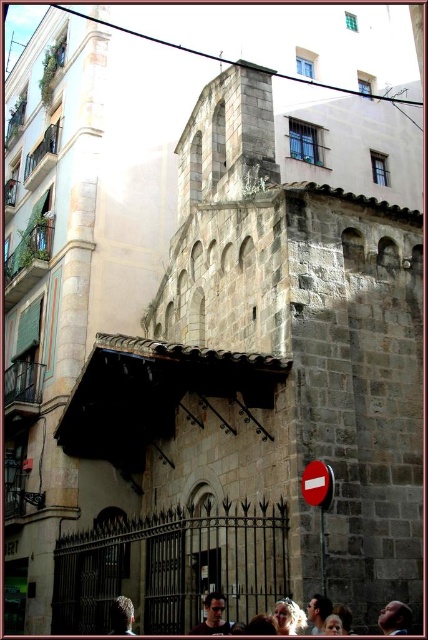
Question: Which object is farther from the camera taking this photo?

Choices:
 (A) red plastic sign at lower right
 (B) dark brown hair at lower left
 (C) smooth skin face at center

Answer: (B)

Question: Which of the following is the farthest from the observer?

Choices:
 (A) red plastic sign at lower right
 (B) red plastic sign at center
 (C) smooth skin face at center
 (D) smooth brown hair at center

Answer: (D)

Question: Can you confirm if smooth brown hair at center is positioned to the left of dark brown hair at lower left?

Choices:
 (A) no
 (B) yes

Answer: (A)

Question: Which point is farther to the camera?

Choices:
 (A) smooth brown hair at center
 (B) red plastic sign at center
 (C) smooth skin face at center
 (D) dark brown hair at lower left

Answer: (D)

Question: Can you confirm if red plastic sign at lower right is smaller than red plastic sign at center?

Choices:
 (A) yes
 (B) no

Answer: (A)

Question: Does smooth brown hair at center come in front of smooth skin face at center?

Choices:
 (A) no
 (B) yes

Answer: (A)